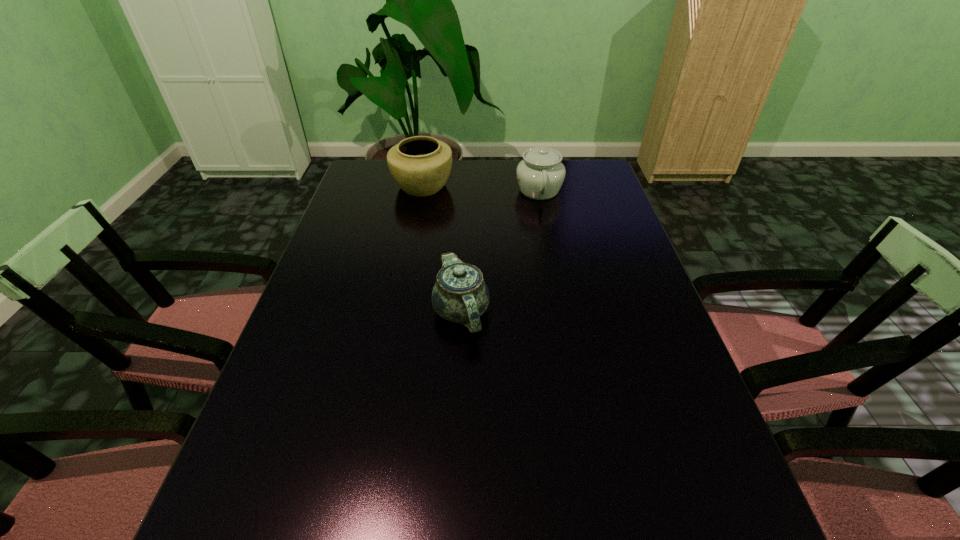
You are a GUI agent. You are given a task and a screenshot of the screen. Output one action in this format:
    pyautogui.click(x=<x>, y=<y>)
    Task: Click on the pottery
    
    Given the screenshot: What is the action you would take?
    pyautogui.click(x=420, y=165)

This screenshot has height=540, width=960. I want to click on the rightmost object, so click(540, 175).

This screenshot has height=540, width=960. I want to click on the right chinaware, so click(x=540, y=175).

The width and height of the screenshot is (960, 540). Find the location of `the left chinaware`. the left chinaware is located at coordinates (x=460, y=295).

Where is `the nearer chinaware`? The height and width of the screenshot is (540, 960). the nearer chinaware is located at coordinates (460, 295).

I want to click on free space located on the front of the pottery, so click(x=414, y=233).

Locate an element on the screen. vacant space located 0.160m on the front of the rightmost object is located at coordinates (548, 238).

Where is `vacant space situated from the spout of the nearest object`? The width and height of the screenshot is (960, 540). vacant space situated from the spout of the nearest object is located at coordinates (454, 475).

This screenshot has height=540, width=960. Identify the location of pottery that is at the far edge. click(420, 165).

In order to click on chinaware that is positioned at the far edge in this screenshot , I will do `click(540, 175)`.